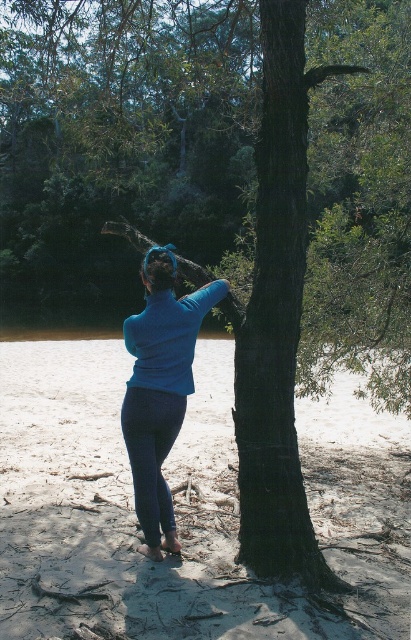
Question: In this image, where is sandy textured sand at center located relative to blue matte leggings at center?

Choices:
 (A) left
 (B) right

Answer: (A)

Question: Which point is farther to the camera?

Choices:
 (A) (171, 410)
 (B) (53, 625)

Answer: (A)

Question: Which of the following is the closest to the observer?

Choices:
 (A) (196, 456)
 (B) (161, 396)

Answer: (B)

Question: Does sandy textured sand at center have a greater width compared to blue matte leggings at center?

Choices:
 (A) yes
 (B) no

Answer: (A)

Question: Can you confirm if sandy textured sand at center is wider than blue matte leggings at center?

Choices:
 (A) no
 (B) yes

Answer: (B)